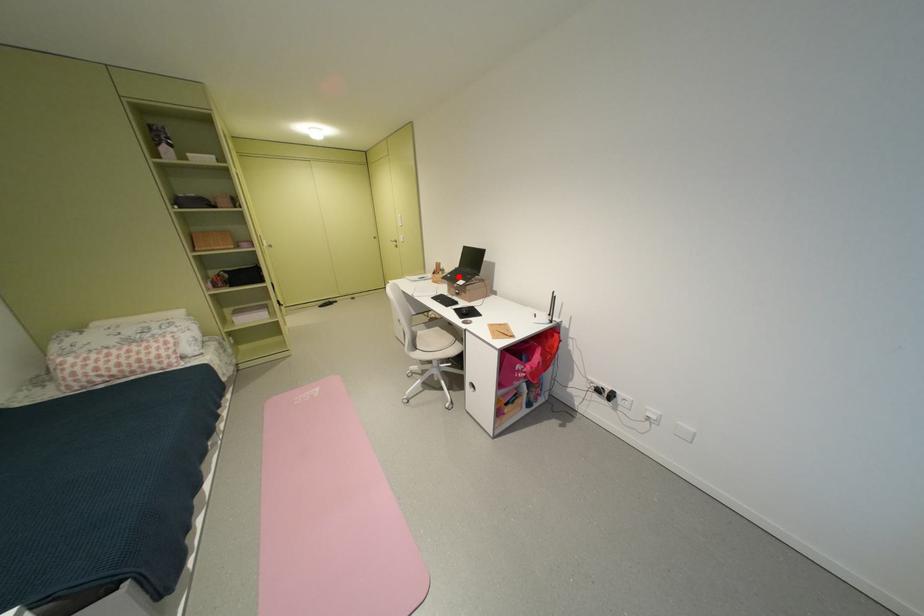
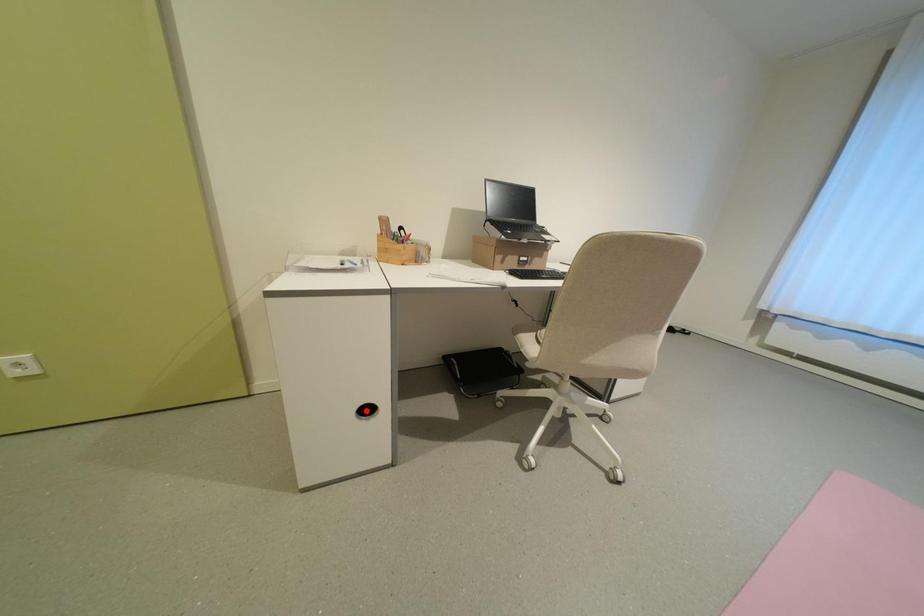
I am providing you with two images of the same scene from different viewpoints. A red point is marked on the first image and another point is marked on the second image. Are the points marked in image1 and image2 representing the same 3D position?

No